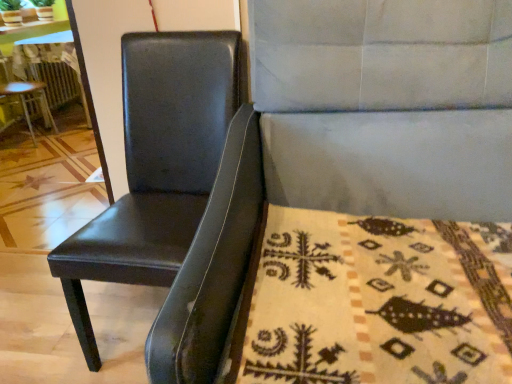
Question: Is wooden table at left not close to black leather chair at left, the 1th chair positioned from the left?

Choices:
 (A) no
 (B) yes

Answer: (A)

Question: Considering the relative sizes of wooden table at left and black leather chair at left, which is the 3th chair from front to back, in the image provided, is wooden table at left shorter than black leather chair at left, which is the 3th chair from front to back,?

Choices:
 (A) yes
 (B) no

Answer: (A)

Question: Is wooden table at left wider than black leather chair at left, the 1th chair positioned from the left?

Choices:
 (A) no
 (B) yes

Answer: (B)

Question: Considering the relative sizes of wooden table at left and black leather chair at left, which is counted as the 3th chair, starting from the right, in the image provided, is wooden table at left bigger than black leather chair at left, which is counted as the 3th chair, starting from the right,?

Choices:
 (A) yes
 (B) no

Answer: (A)

Question: Considering the relative sizes of wooden table at left and black leather chair at left, which is counted as the 3th chair, starting from the right, in the image provided, is wooden table at left thinner than black leather chair at left, which is counted as the 3th chair, starting from the right,?

Choices:
 (A) no
 (B) yes

Answer: (A)

Question: Does wooden table at left lie behind black leather chair at left, which is counted as the 3th chair, starting from the right?

Choices:
 (A) no
 (B) yes

Answer: (B)

Question: Can you confirm if black leather chair at left, the 1th chair positioned from the left, is shorter than black leather chair at left, acting as the third chair starting from the left?

Choices:
 (A) yes
 (B) no

Answer: (A)

Question: Does black leather chair at left, which is counted as the 3th chair, starting from the right, have a larger size compared to black leather chair at left, acting as the first chair starting from the right?

Choices:
 (A) no
 (B) yes

Answer: (A)

Question: Is black leather chair at left, the first chair viewed from the back, next to black leather chair at left, the 3th chair from the back?

Choices:
 (A) no
 (B) yes

Answer: (A)

Question: Is black leather chair at left, the first chair viewed from the back, thinner than black leather chair at left, the 3th chair from the back?

Choices:
 (A) no
 (B) yes

Answer: (B)

Question: From the image's perspective, is black leather chair at left, the first chair viewed from the back, under black leather chair at left, acting as the third chair starting from the left?

Choices:
 (A) yes
 (B) no

Answer: (B)

Question: From the image's perspective, would you say black leather chair at left, which is counted as the 3th chair, starting from the right, is positioned over black leather chair at left, acting as the first chair starting from the right?

Choices:
 (A) yes
 (B) no

Answer: (A)

Question: Is wooden table at left thinner than beige woolen blanket at lower right?

Choices:
 (A) no
 (B) yes

Answer: (B)